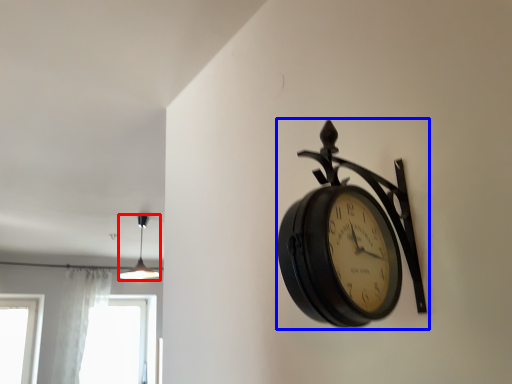
Question: Which object appears closest to the camera in this image, lamp (highlighted by a red box) or wall clock (highlighted by a blue box)?

Choices:
 (A) lamp
 (B) wall clock

Answer: (B)